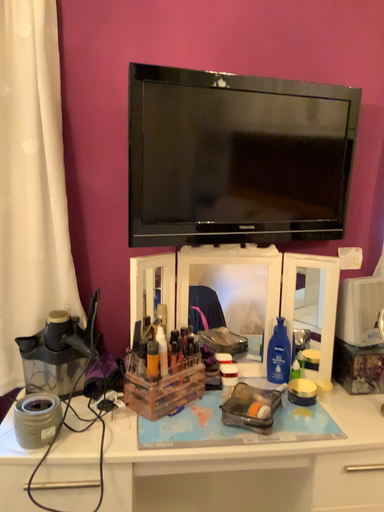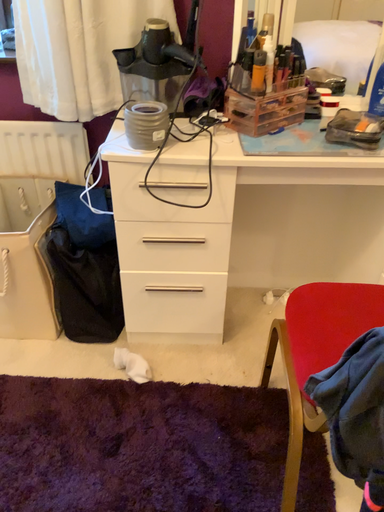
Question: Which way did the camera rotate in the video?

Choices:
 (A) rotated left
 (B) rotated right

Answer: (A)